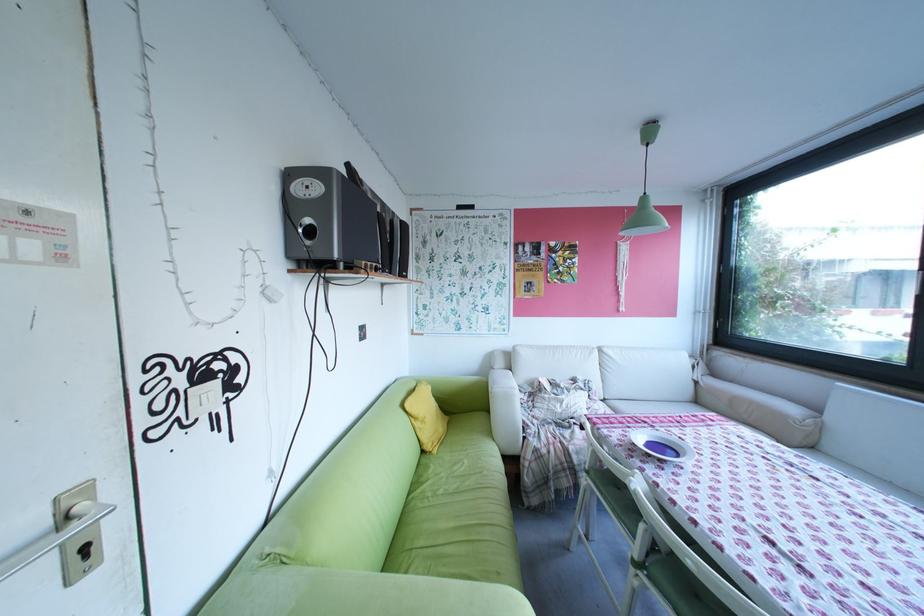
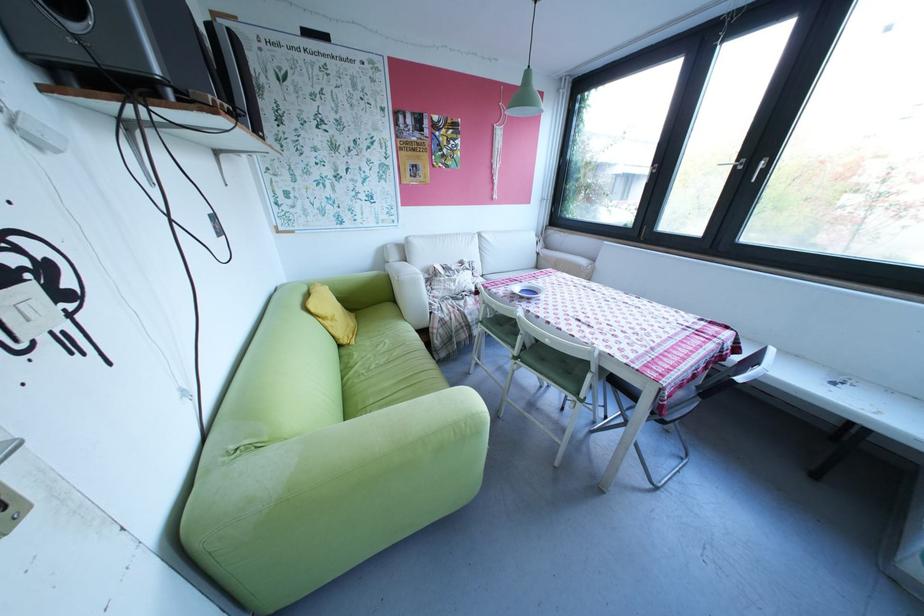
Locate, in the second image, the point that corresponds to point 646,570 in the first image.

(526, 361)